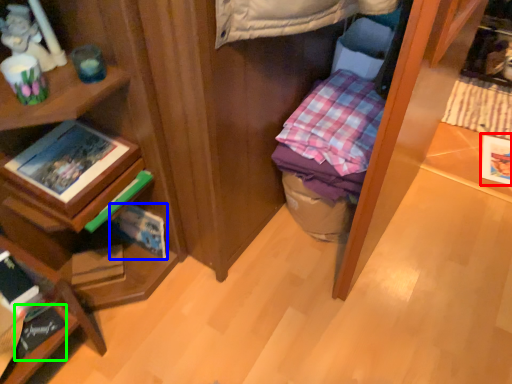
Question: Estimate the real-world distances between objects in this image. Which object is closer to paperback book (highlighted by a red box), paperback book (highlighted by a blue box) or book (highlighted by a green box)?

Choices:
 (A) paperback book
 (B) book

Answer: (A)